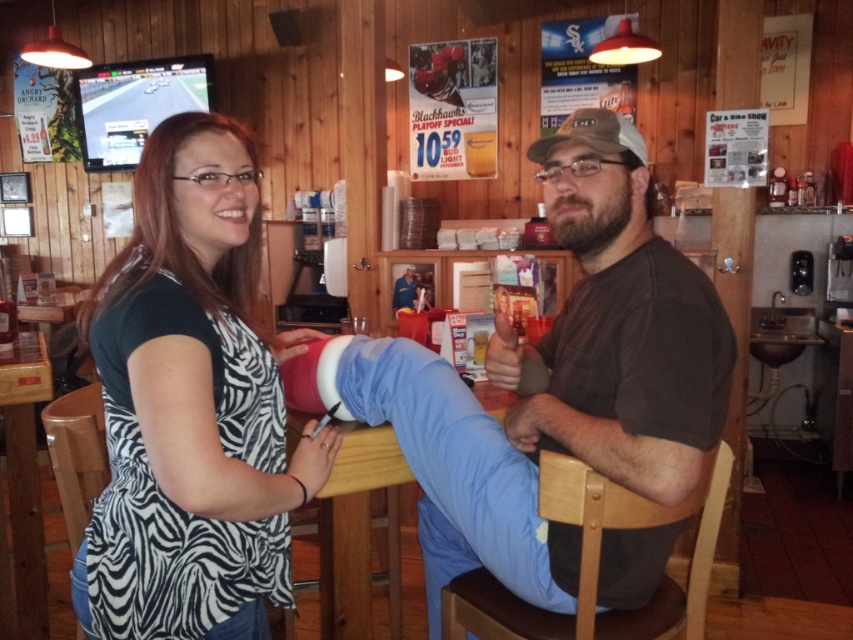
You are standing in the bar and want to find the zebra print shirt at left. According to the coordinates provided, where should you look to locate it?

The zebra print shirt at left is located at point (190, 404), so you should look there to find it.

You are a photographer setting up for a group photo. You need to arrange the subjects so that both the zebra print shirt at left and the brown cotton shirt at center are visible. Given their sizes, which shirt should be placed closer to the camera to ensure both are fully visible in the photo?

The zebra print shirt at left occupies less space than the brown cotton shirt at center. To ensure both are fully visible, the smaller zebra print shirt at left should be placed closer to the camera so that its size in the photo matches the larger brown cotton shirt at center.

You are standing in the bar and want to place a small decoration between the two points labeled as point (180, 150) and point (624, 416). Which point should you place it closer to in order for it to appear closer to you?

You should place the decoration closer to point (180, 150) because it is closer to you than point (624, 416).